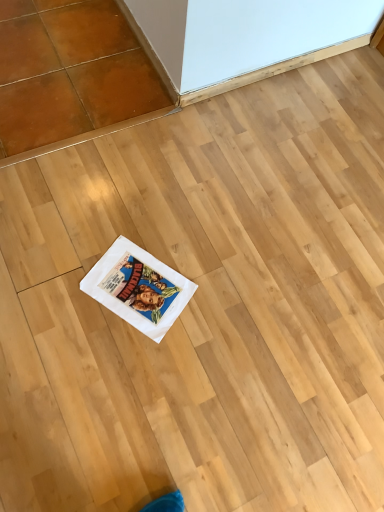
The height and width of the screenshot is (512, 384). I want to click on vacant area situated to the left side of white paper comic book at center, so click(x=64, y=268).